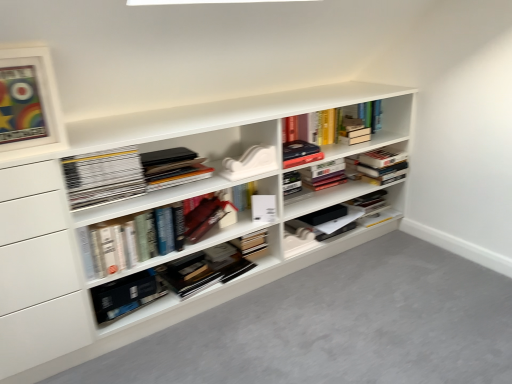
Question: Is hardcover books at center, the 1th book in the bottom-to-top sequence, aimed at matte white picture frame at upper left?

Choices:
 (A) yes
 (B) no

Answer: (B)

Question: Is hardcover books at center, acting as the 3th book starting from the top, surrounding matte white picture frame at upper left?

Choices:
 (A) no
 (B) yes

Answer: (A)

Question: Is there a large distance between hardcover books at center, the 1th book in the bottom-to-top sequence, and matte white picture frame at upper left?

Choices:
 (A) no
 (B) yes

Answer: (A)

Question: From the image's perspective, does hardcover books at center, the 1th book in the bottom-to-top sequence, appear lower than matte white picture frame at upper left?

Choices:
 (A) yes
 (B) no

Answer: (A)

Question: Does hardcover books at center, acting as the 3th book starting from the top, appear on the right side of matte white picture frame at upper left?

Choices:
 (A) yes
 (B) no

Answer: (A)

Question: Is hardcover books at center, the 1th book in the bottom-to-top sequence, taller than matte white picture frame at upper left?

Choices:
 (A) no
 (B) yes

Answer: (A)

Question: Does hardcover book at center, the first paperback book when ordered from left to right, have a lesser height compared to hardcover books at center, acting as the 3th book starting from the top?

Choices:
 (A) no
 (B) yes

Answer: (B)

Question: Can you confirm if hardcover book at center, the second paperback book in the right-to-left sequence, is thinner than hardcover books at center, the 1th book in the bottom-to-top sequence?

Choices:
 (A) yes
 (B) no

Answer: (B)

Question: Does hardcover book at center, the second paperback book in the right-to-left sequence, have a greater width compared to hardcover books at center, acting as the 3th book starting from the top?

Choices:
 (A) yes
 (B) no

Answer: (A)

Question: Is hardcover book at center, the first paperback book when ordered from left to right, further to camera compared to hardcover books at center, the 1th book in the bottom-to-top sequence?

Choices:
 (A) no
 (B) yes

Answer: (B)

Question: Is hardcover book at center, the first paperback book when ordered from left to right, taller than hardcover books at center, acting as the 3th book starting from the top?

Choices:
 (A) yes
 (B) no

Answer: (B)

Question: From a real-world perspective, is hardcover book at center, which is counted as the second paperback book, starting from the top, located higher than hardcover books at center, the 1th book in the bottom-to-top sequence?

Choices:
 (A) no
 (B) yes

Answer: (A)

Question: Is white matte paperback book at center, the second paperback book in the left-to-right sequence, turned away from white matte bookshelf at center?

Choices:
 (A) no
 (B) yes

Answer: (B)